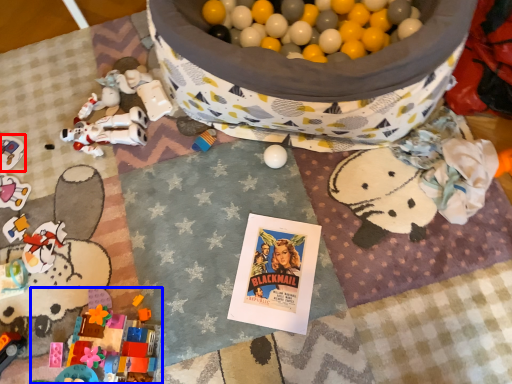
Question: Which point is closer to the camera, toy (highlighted by a red box) or toy (highlighted by a blue box)?

Choices:
 (A) toy
 (B) toy

Answer: (B)